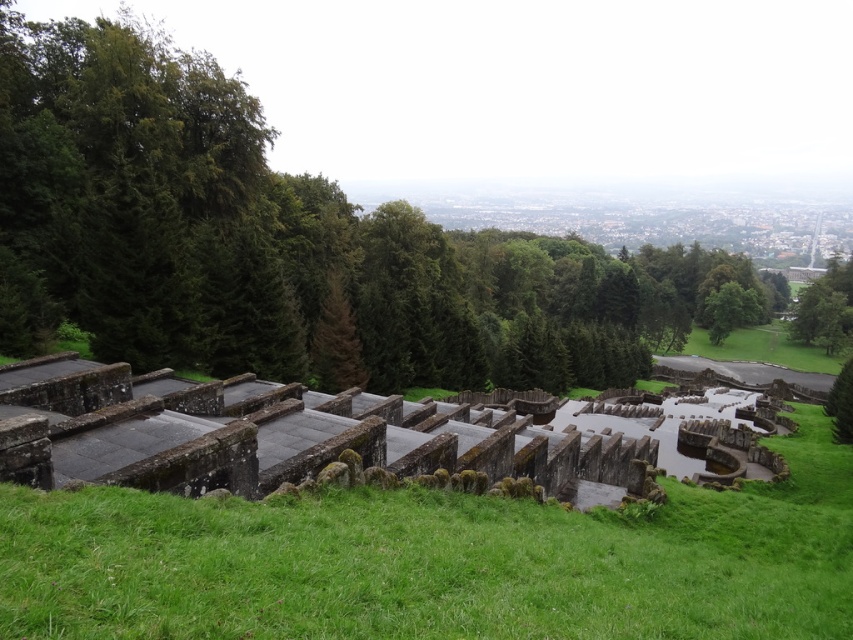
Question: Which point is farther to the camera?

Choices:
 (A) green leafy tree at upper center
 (B) green leafy tree at lower right

Answer: (A)

Question: Observing the image, what is the correct spatial positioning of green leafy tree at upper center in reference to green leafy tree at lower right?

Choices:
 (A) above
 (B) below

Answer: (A)

Question: Does green leafy tree at upper center have a smaller size compared to green leafy tree at lower right?

Choices:
 (A) no
 (B) yes

Answer: (A)

Question: In this image, where is green leafy tree at upper center located relative to green leafy tree at lower right?

Choices:
 (A) left
 (B) right

Answer: (B)

Question: Which object appears closest to the camera in this image?

Choices:
 (A) green leafy tree at lower right
 (B) green leafy tree at upper center

Answer: (A)